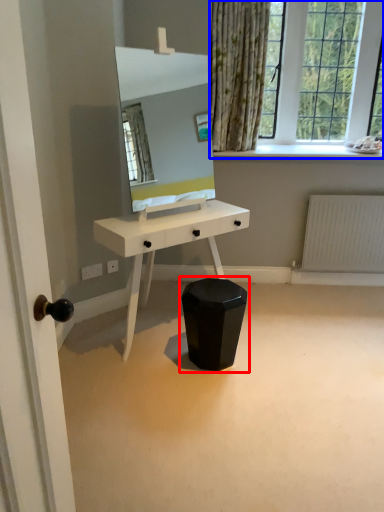
Question: Which object appears closest to the camera in this image, swivel chair (highlighted by a red box) or window (highlighted by a blue box)?

Choices:
 (A) swivel chair
 (B) window

Answer: (A)